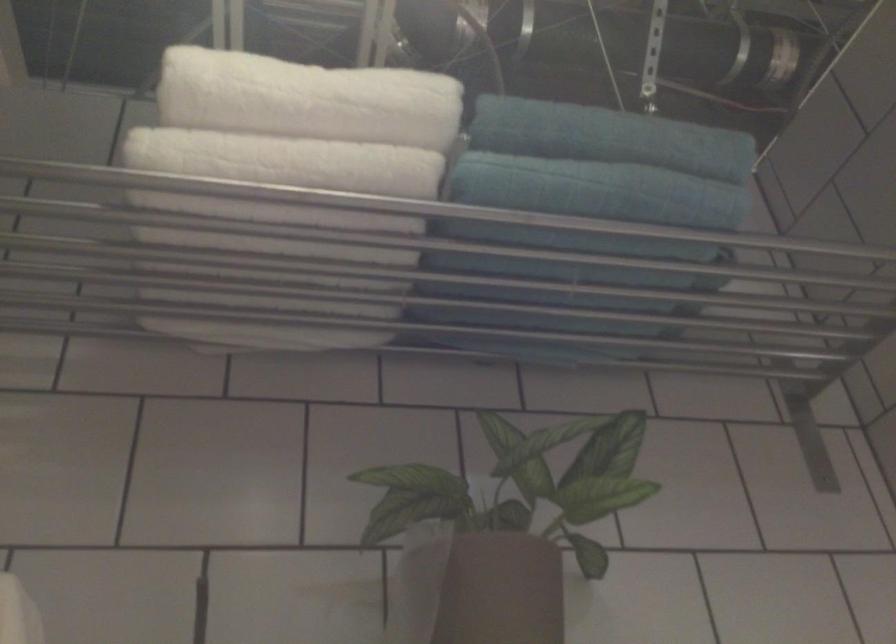
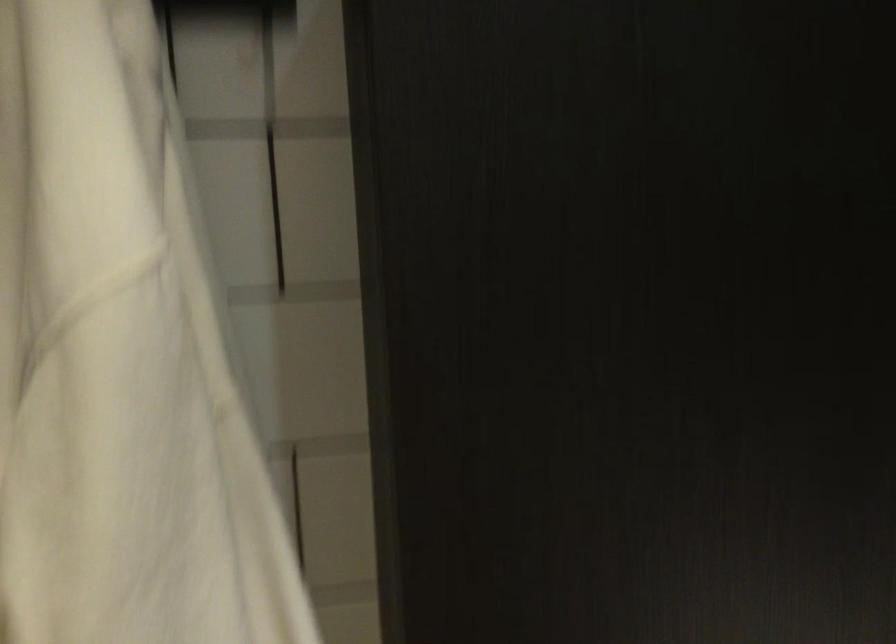
Question: The images are taken continuously from a first-person perspective. In which direction is your viewpoint rotating?

Choices:
 (A) Left
 (B) Right
 (C) Up
 (D) Down

Answer: (D)